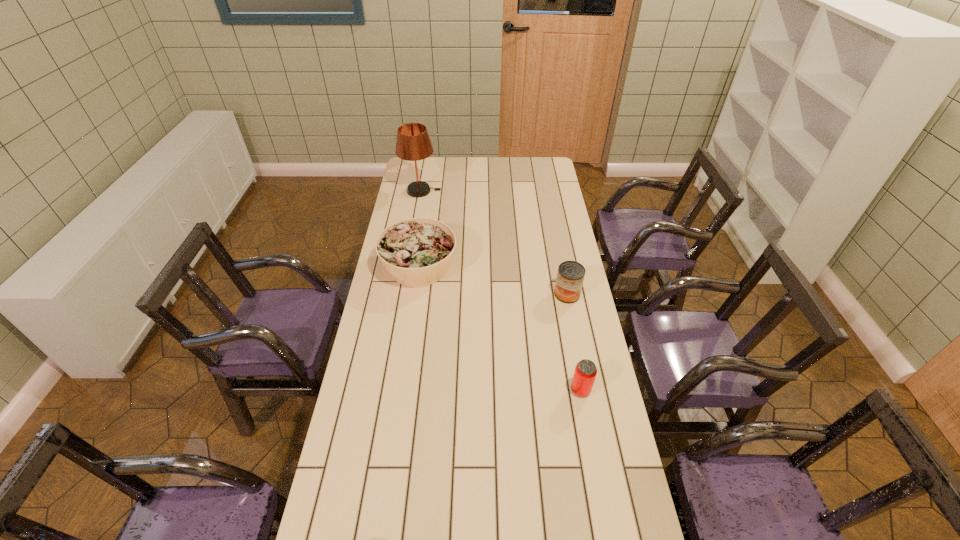
The height and width of the screenshot is (540, 960). Find the location of `blank area in the image that satisfies the following two spatial constraints: 1. on the front-facing side of the farthest object; 2. on the right side of the nearest object`. blank area in the image that satisfies the following two spatial constraints: 1. on the front-facing side of the farthest object; 2. on the right side of the nearest object is located at coordinates (386, 390).

Find the location of a particular element. free location that satisfies the following two spatial constraints: 1. on the back side of the farther can; 2. on the left side of the nearer can is located at coordinates (563, 294).

Locate an element on the screen. This screenshot has width=960, height=540. vacant region that satisfies the following two spatial constraints: 1. on the front-facing side of the salad; 2. on the right side of the farthest object is located at coordinates (408, 267).